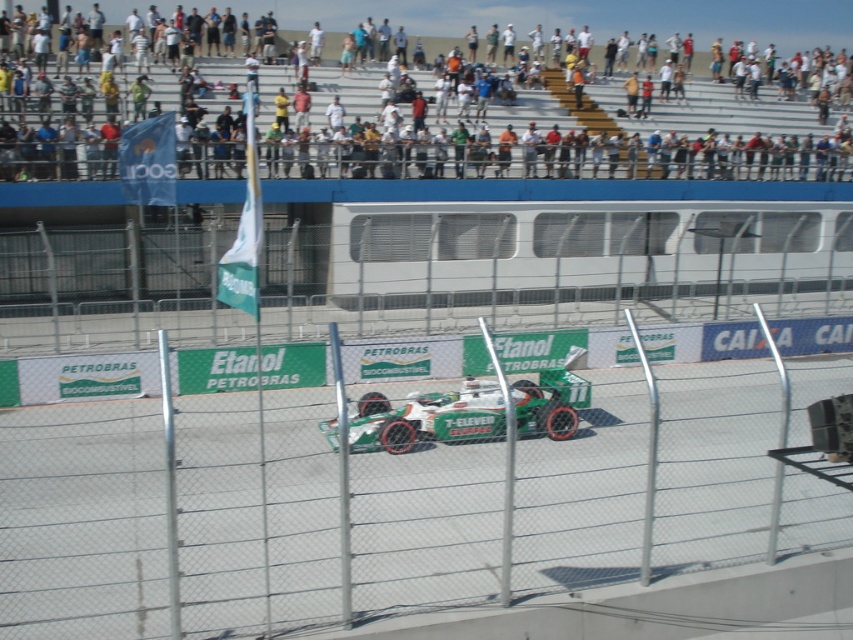
Question: Does metal chain-link fence at center appear on the right side of green racing car at center?

Choices:
 (A) yes
 (B) no

Answer: (B)

Question: Observing the image, what is the correct spatial positioning of green racing car at center in reference to green matte race car at center?

Choices:
 (A) below
 (B) above

Answer: (B)

Question: Estimate the real-world distances between objects in this image. Which object is closer to the metal chain-link fence at center?

Choices:
 (A) green matte race car at center
 (B) green racing car at center

Answer: (A)

Question: Which object appears closest to the camera in this image?

Choices:
 (A) metal chain-link fence at center
 (B) green racing car at center
 (C) green matte race car at center

Answer: (A)

Question: Can you confirm if metal chain-link fence at center is positioned above green matte race car at center?

Choices:
 (A) no
 (B) yes

Answer: (B)

Question: Which object appears farthest from the camera in this image?

Choices:
 (A) green racing car at center
 (B) metal chain-link fence at center

Answer: (A)